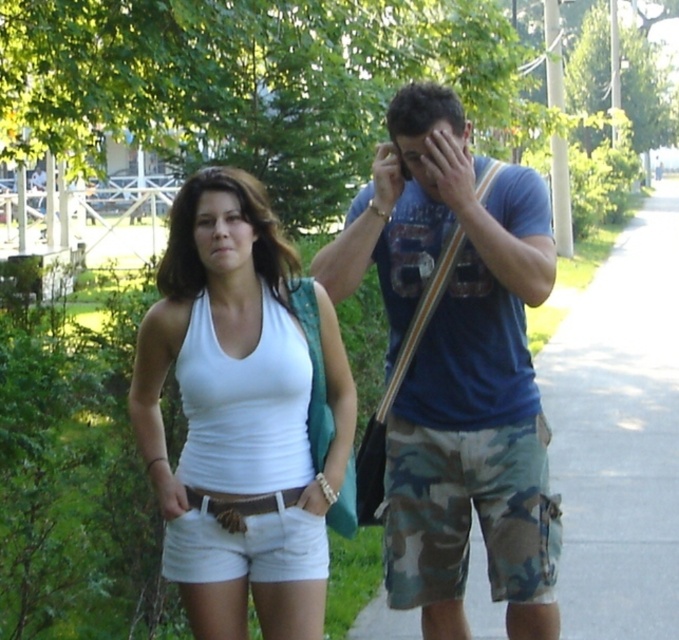
Question: Is white matte tank top at center behind matte blue shirt at center?

Choices:
 (A) yes
 (B) no

Answer: (B)

Question: Which object is farther from the camera taking this photo?

Choices:
 (A) matte white tank top at center
 (B) camo shorts at right
 (C) matte blue shirt at center
 (D) white matte tank top at center

Answer: (C)

Question: Can you confirm if matte white tank top at center is positioned above matte blue shirt at center?

Choices:
 (A) no
 (B) yes

Answer: (A)

Question: Considering the real-world distances, which object is farthest from the camo shorts at right?

Choices:
 (A) white matte tank top at center
 (B) matte blue shirt at center

Answer: (A)

Question: Which of the following is the farthest from the observer?

Choices:
 (A) (x=304, y=449)
 (B) (x=433, y=324)

Answer: (B)

Question: Is camo shorts at right bigger than matte blue shirt at center?

Choices:
 (A) no
 (B) yes

Answer: (B)